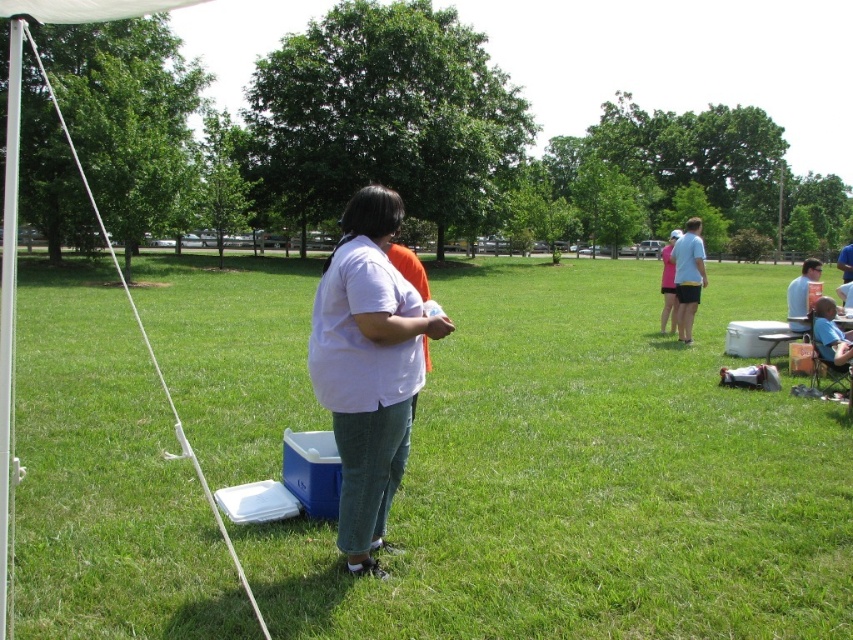
Question: Does blue denim shorts at right have a greater width compared to pink fabric shirt at center?

Choices:
 (A) no
 (B) yes

Answer: (A)

Question: Among these points, which one is farthest from the camera?

Choices:
 (A) (668, 273)
 (B) (837, 349)
 (C) (786, 296)

Answer: (C)

Question: Can you confirm if blue fabric chair at lower right is positioned above pink fabric shirt at center?

Choices:
 (A) yes
 (B) no

Answer: (B)

Question: Can you confirm if white matte shirt at center is smaller than blue fabric chair at lower right?

Choices:
 (A) yes
 (B) no

Answer: (B)

Question: Which point is farther to the camera?

Choices:
 (A) white matte shirt at center
 (B) pink fabric shirt at center
 (C) blue fabric chair at lower right

Answer: (B)

Question: Which of the following is the closest to the observer?

Choices:
 (A) light blue shirt at center
 (B) pink fabric shirt at center

Answer: (A)